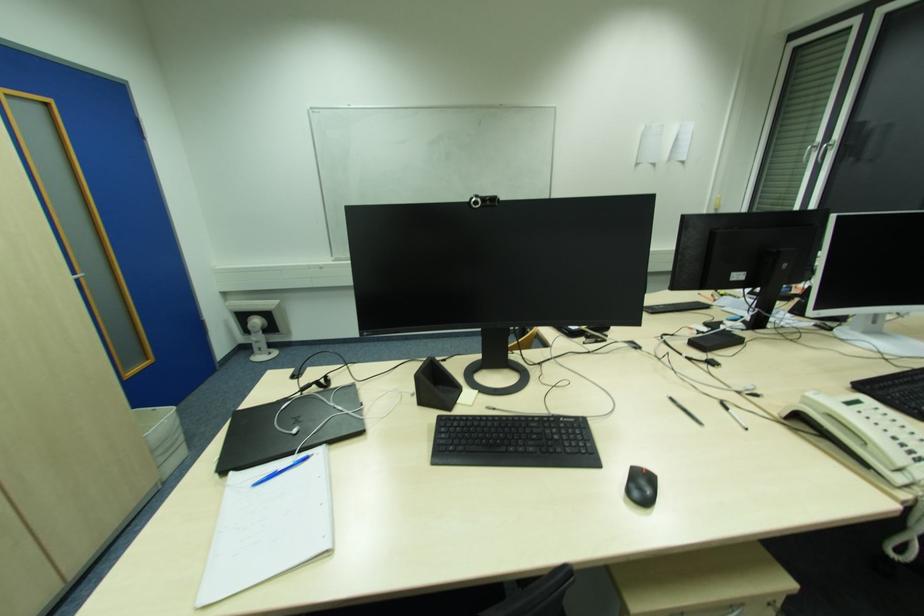
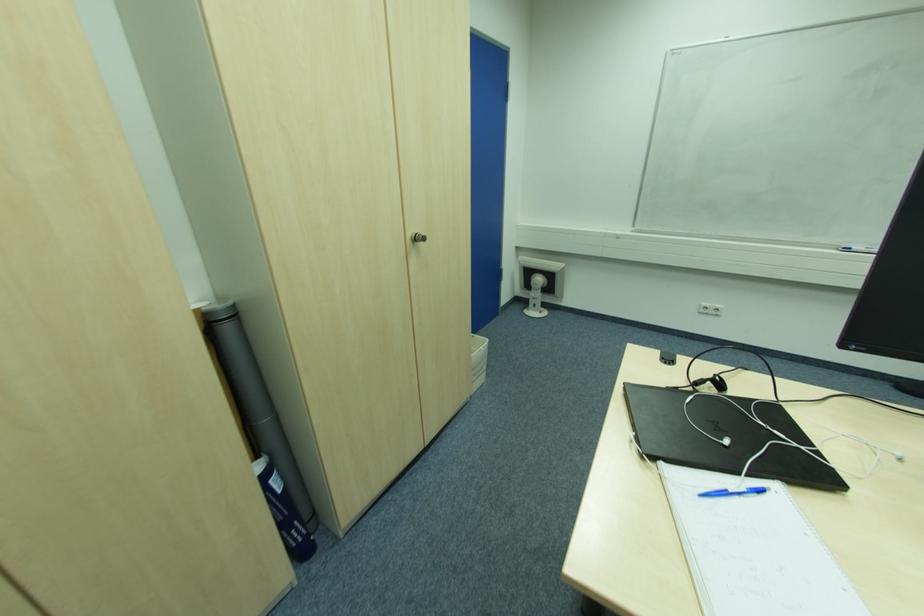
The point at (305, 390) is marked in the first image. Where is the corresponding point in the second image?

(699, 385)